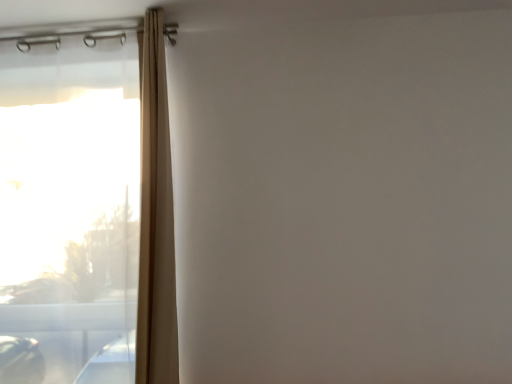
Question: Considering the positions of transparent plastic window at left and beige fabric curtain at left in the image, is transparent plastic window at left wider or thinner than beige fabric curtain at left?

Choices:
 (A) thin
 (B) wide

Answer: (A)

Question: Based on their sizes in the image, would you say transparent plastic window at left is bigger or smaller than beige fabric curtain at left?

Choices:
 (A) small
 (B) big

Answer: (B)

Question: From a real-world perspective, is transparent plastic window at left positioned above or below beige fabric curtain at left?

Choices:
 (A) above
 (B) below

Answer: (B)

Question: Is beige fabric curtain at left bigger or smaller than transparent plastic window at left?

Choices:
 (A) big
 (B) small

Answer: (B)

Question: Does point (158, 206) appear closer or farther from the camera than point (144, 140)?

Choices:
 (A) farther
 (B) closer

Answer: (A)

Question: In terms of height, does beige fabric curtain at left look taller or shorter compared to transparent plastic window at left?

Choices:
 (A) tall
 (B) short

Answer: (B)

Question: From the image's perspective, is beige fabric curtain at left located above or below transparent plastic window at left?

Choices:
 (A) above
 (B) below

Answer: (A)